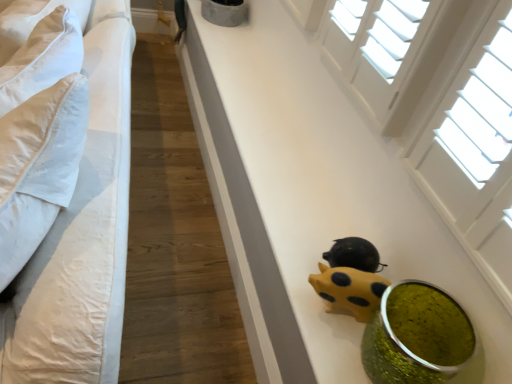
Where is `yellow matte piggy bank at lower center`? This screenshot has width=512, height=384. yellow matte piggy bank at lower center is located at coordinates (349, 290).

What do you see at coordinates (331, 186) in the screenshot? I see `yellow matte piggy bank at lower center` at bounding box center [331, 186].

In order to click on yellow matte piggy bank at lower center in this screenshot , I will do `click(331, 186)`.

Where is `green glittery vase at lower right`? This screenshot has height=384, width=512. green glittery vase at lower right is located at coordinates tap(416, 336).

Is white cotton bed at left oriented towards yellow matte piggy bank at lower center?

Yes, white cotton bed at left is oriented towards yellow matte piggy bank at lower center.

From the image's perspective, does white cotton bed at left appear lower than yellow matte piggy bank at lower center?

→ Indeed, from the image's perspective, white cotton bed at left is shown beneath yellow matte piggy bank at lower center.

Is white cotton bed at left to the left of yellow matte piggy bank at lower center from the viewer's perspective?

Indeed, white cotton bed at left is positioned on the left side of yellow matte piggy bank at lower center.

Does point (82, 307) appear closer or farther from the camera than point (326, 331)?

Point (82, 307) appears to be closer to the viewer than point (326, 331).

Is point (451, 329) closer or farther from the camera than point (208, 54)?

Point (451, 329) is positioned closer to the camera compared to point (208, 54).

Which of these two, green glittery vase at lower right or yellow matte piggy bank at lower center, is bigger?

yellow matte piggy bank at lower center is bigger.

Which of these two, green glittery vase at lower right or yellow matte piggy bank at lower center, stands shorter?

With less height is yellow matte piggy bank at lower center.

From the image's perspective, is green glittery vase at lower right located above yellow matte piggy bank at lower center?

Incorrect, from the image's perspective, green glittery vase at lower right is lower than yellow matte piggy bank at lower center.

From a real-world perspective, which object rests below the other?

yellow matte piggy bank at lower center.

From the image's perspective, which is above, yellow matte piggy bank at lower center or yellow matte piggy bank at lower center?

yellow matte piggy bank at lower center appears higher in the image.

Can you confirm if yellow matte piggy bank at lower center is smaller than yellow matte piggy bank at lower center?

Indeed, yellow matte piggy bank at lower center has a smaller size compared to yellow matte piggy bank at lower center.

From the image's perspective, would you say green glittery vase at lower right is shown under yellow matte piggy bank at lower center?

Yes.

Which is more to the right, green glittery vase at lower right or yellow matte piggy bank at lower center?

From the viewer's perspective, green glittery vase at lower right appears more on the right side.

Which object is wider, green glittery vase at lower right or yellow matte piggy bank at lower center?

green glittery vase at lower right is wider.

From a real-world perspective, who is located higher, green glittery vase at lower right or yellow matte piggy bank at lower center?

green glittery vase at lower right.

Based on their sizes in the image, would you say yellow matte piggy bank at lower center is bigger or smaller than green glittery vase at lower right?

Clearly, yellow matte piggy bank at lower center is smaller in size than green glittery vase at lower right.

Is yellow matte piggy bank at lower center next to green glittery vase at lower right and touching it?

yellow matte piggy bank at lower center and green glittery vase at lower right are clearly separated.

Considering the relative sizes of yellow matte piggy bank at lower center and green glittery vase at lower right in the image provided, is yellow matte piggy bank at lower center wider than green glittery vase at lower right?

No, yellow matte piggy bank at lower center is not wider than green glittery vase at lower right.

Can you tell me how much yellow matte piggy bank at lower center and green glittery vase at lower right differ in facing direction?

They differ by 33.1 degrees in their facing directions.

Is yellow matte piggy bank at lower center shorter than white cotton bed at left?

Yes.

Consider the image. From the image's perspective, is yellow matte piggy bank at lower center on top of white cotton bed at left?

Incorrect, from the image's perspective, yellow matte piggy bank at lower center is lower than white cotton bed at left.

Is yellow matte piggy bank at lower center wider or thinner than white cotton bed at left?

Clearly, yellow matte piggy bank at lower center has less width compared to white cotton bed at left.

Does point (341, 303) appear closer or farther from the camera than point (117, 235)?

Clearly, point (341, 303) is more distant from the camera than point (117, 235).

Visually, is white cotton bed at left positioned to the left or to the right of green glittery vase at lower right?

white cotton bed at left is positioned on green glittery vase at lower right's left side.

The image size is (512, 384). I want to click on food on the right of white cotton bed at left, so click(416, 336).

Which is in front, point (118, 306) or point (417, 382)?

The point (118, 306) is in front.

From a real-world perspective, relative to green glittery vase at lower right, is white cotton bed at left vertically above or below?

From a real-world perspective, white cotton bed at left is physically below green glittery vase at lower right.

Where is `table that appears above the white cotton bed at left (from a real-world perspective)`? The image size is (512, 384). table that appears above the white cotton bed at left (from a real-world perspective) is located at coordinates (331, 186).

Locate an element on the screen. The width and height of the screenshot is (512, 384). food to the right of yellow matte piggy bank at lower center is located at coordinates (416, 336).

Looking at the image, which one is located closer to yellow matte piggy bank at lower center, white cotton bed at left or yellow matte piggy bank at lower center?

The object closer to yellow matte piggy bank at lower center is yellow matte piggy bank at lower center.

Which object lies further to the anchor point green glittery vase at lower right, yellow matte piggy bank at lower center or yellow matte piggy bank at lower center?

yellow matte piggy bank at lower center lies further to green glittery vase at lower right than the other object.

Looking at the image, which one is located closer to white cotton bed at left, yellow matte piggy bank at lower center or yellow matte piggy bank at lower center?

yellow matte piggy bank at lower center is positioned closer to the anchor white cotton bed at left.

Looking at the image, which one is located further to white cotton bed at left, yellow matte piggy bank at lower center or green glittery vase at lower right?

green glittery vase at lower right.

When comparing their distances from yellow matte piggy bank at lower center, does yellow matte piggy bank at lower center or white cotton bed at left seem further?

white cotton bed at left is further to yellow matte piggy bank at lower center.

From the image, which object appears to be farther from white cotton bed at left, green glittery vase at lower right or yellow matte piggy bank at lower center?

The object further to white cotton bed at left is green glittery vase at lower right.

From the image, which object appears to be farther from green glittery vase at lower right, yellow matte piggy bank at lower center or white cotton bed at left?

white cotton bed at left.

Looking at the image, which one is located closer to green glittery vase at lower right, white cotton bed at left or yellow matte piggy bank at lower center?

Based on the image, yellow matte piggy bank at lower center appears to be nearer to green glittery vase at lower right.

At what (x,y) coordinates should I click in order to perform the action: click on table between white cotton bed at left and green glittery vase at lower right. Please return your answer as a coordinate pair (x, y). This screenshot has height=384, width=512. Looking at the image, I should click on (331, 186).

Locate an element on the screen. This screenshot has height=384, width=512. toy between white cotton bed at left and green glittery vase at lower right in the horizontal direction is located at coordinates (349, 290).

The width and height of the screenshot is (512, 384). In order to click on toy between yellow matte piggy bank at lower center and green glittery vase at lower right in the vertical direction in this screenshot , I will do `click(349, 290)`.

This screenshot has width=512, height=384. Find the location of `table between white cotton bed at left and yellow matte piggy bank at lower center`. table between white cotton bed at left and yellow matte piggy bank at lower center is located at coordinates (331, 186).